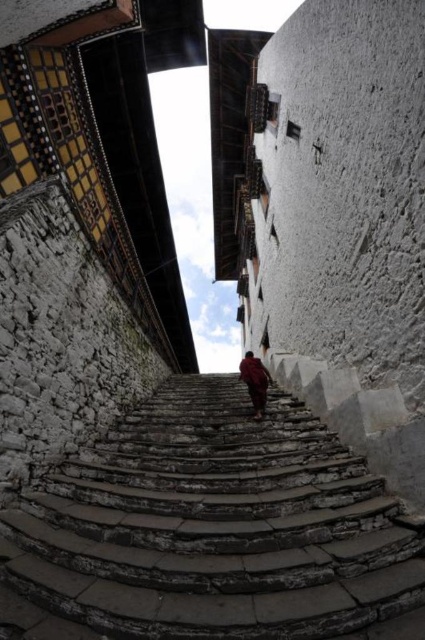
You are standing at the bottom of the stone stairs at center in a historical area. You want to reach a temple located at coordinates point 0.827, 0.494. Are you already at the correct location?

The stone stairs at center is located at point (209, 529), so yes, you are already at the correct location to reach the temple.

You are a tourist standing at the base of the stone stairs at center in front of two traditional buildings. You want to take a photo of the stairs with the buildings in the background. Will the buildings be in focus if you focus on the stairs?

The stone stairs at center are 5.58 meters away from the camera. Since the buildings are farther away than the stairs, if you focus on the stairs, the buildings might be slightly out of focus depending on the camera settings. To ensure both are in focus, use a smaller aperture or adjust the focus point accordingly.

You are a traveler carrying a red woolen robe and need to walk up the stone stairs. Will the red woolen robe at center fit across the width of the stone stairs at center?

The stone stairs at center are wider than the red woolen robe at center, so the robe will fit across the width of the stone stairs at center.